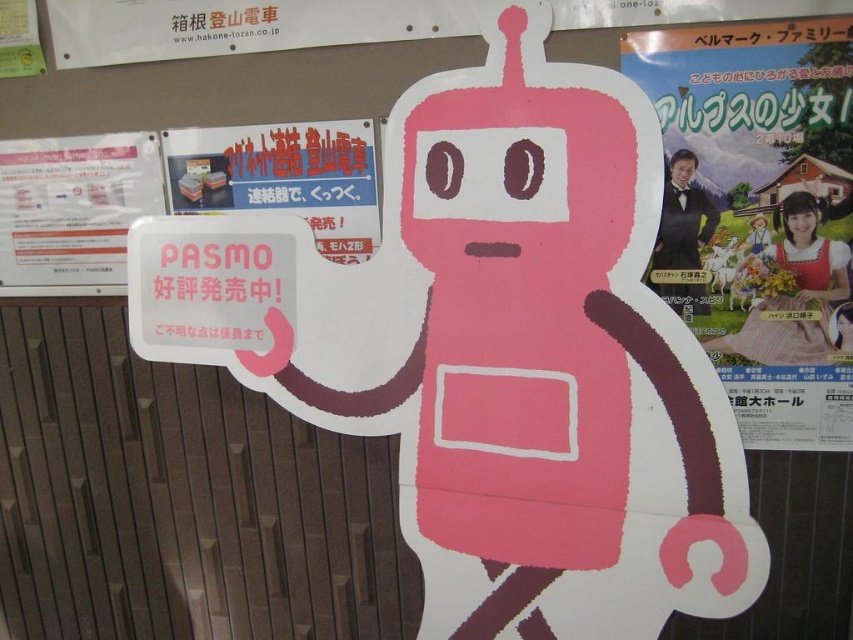
How distant is matte paper sign at upper left from matte plastic sign at upper center?

matte paper sign at upper left and matte plastic sign at upper center are 23.19 centimeters apart.

Which is more to the right, matte paper sign at upper left or matte plastic sign at upper center?

Positioned to the right is matte plastic sign at upper center.

Is point (32, 259) behind point (334, 240)?

Yes.

The width and height of the screenshot is (853, 640). What are the coordinates of `matte paper sign at upper left` in the screenshot? It's located at (73, 211).

Based on the photo, is matte paper poster at right positioned at the back of matte paper sign at upper left?

That is False.

Between matte paper poster at right and matte paper sign at upper left, which one has more height?

matte paper poster at right

This screenshot has height=640, width=853. Find the location of `matte paper poster at right`. matte paper poster at right is located at coordinates (759, 214).

Is point (704, 250) positioned before point (245, 154)?

Yes, point (704, 250) is closer to viewer.

How much distance is there between matte paper poster at right and matte plastic sign at upper center?

matte paper poster at right and matte plastic sign at upper center are 27.54 inches apart from each other.

Which is in front, point (735, 32) or point (372, 214)?

Point (735, 32) is in front.

Locate an element on the screen. The height and width of the screenshot is (640, 853). matte paper poster at right is located at coordinates (759, 214).